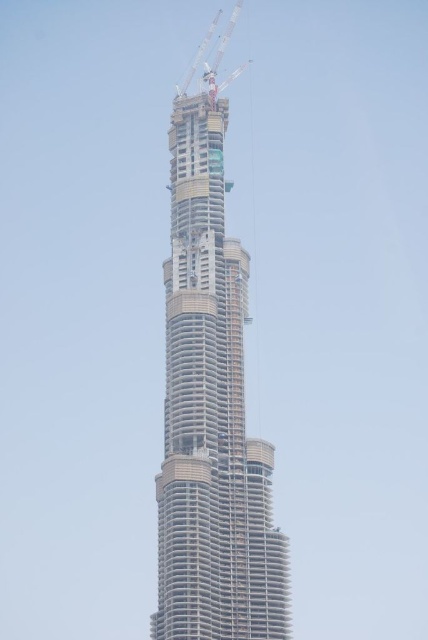
You are standing at the origin point of the coordinate system. You want to walk towards the beige concrete tower at center. Which direction should you move in?

Since the beige concrete tower at center is located at coordinate point 0.650 on the x axis and 0.493 on the y axis, you should move towards the northeast direction to reach it.

You are a construction worker planning to move a heavy equipment from the ground to the top of the beige concrete tower at center. The white metallic crane at upper center is already in place. Can you use the crane to lift the equipment to the top of the tower?

The beige concrete tower at center is located below the white metallic crane at upper center, so the crane can reach the top of the tower to lift the equipment.

You are standing at a safe distance from the beige concrete tower at center. If you want to take a photo of the entire tower without any cropping, would you need to move closer or farther away?

The beige concrete tower at center and camera are 285.09 feet apart. To capture the entire tower in one photo without cropping, you would need to move farther away from the beige concrete tower at center to ensure the entire structure fits within the camera frame.